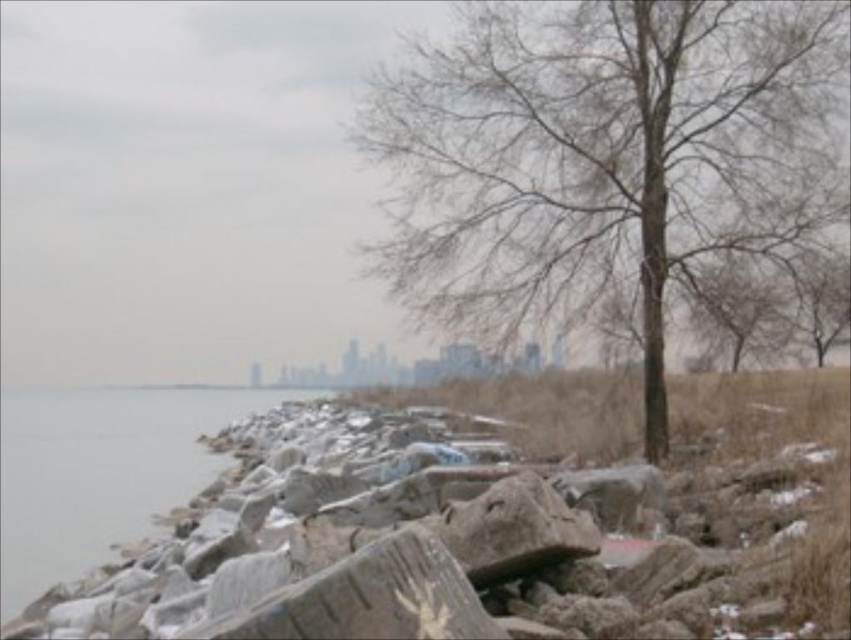
You are standing on the rocky shoreline and want to cross to the other side. The gray stone rocks at lower left and the gray stone water at left are in your path. Which one do you think is wider, making it easier to walk across?

The gray stone rocks at lower left might be wider than gray stone water at left, so the rocks are wider and easier to walk across.

You are standing at the edge of the rocky shoreline in the coastal scene. You see two points marked on the image. The first point is at coordinate point (x=764, y=611), and the second is at point (x=146, y=509). If you want to walk from the first point to the second, will you have to go towards the shore or away from it?

Point (x=764, y=611) is in front of point (x=146, y=509). Since the first point is in front, moving from the first to the second would mean walking away from the shore towards the middle ground.